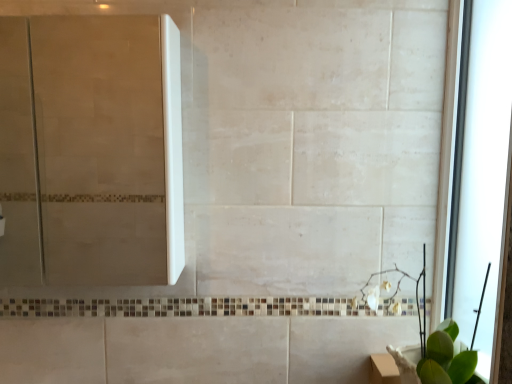
Question: Is point (69, 119) positioned closer to the camera than point (470, 372)?

Choices:
 (A) farther
 (B) closer

Answer: (A)

Question: Considering their positions, is white glossy screen door at upper left located in front of or behind green leafy plant at lower right?

Choices:
 (A) behind
 (B) front

Answer: (A)

Question: Considering the real-world distances, which object is farthest from the transparent glass window at right?

Choices:
 (A) green leafy plant at lower right
 (B) white glossy screen door at upper left

Answer: (B)

Question: Estimate the real-world distances between objects in this image. Which object is closer to the green leafy plant at lower right?

Choices:
 (A) white glossy screen door at upper left
 (B) transparent glass window at right

Answer: (B)